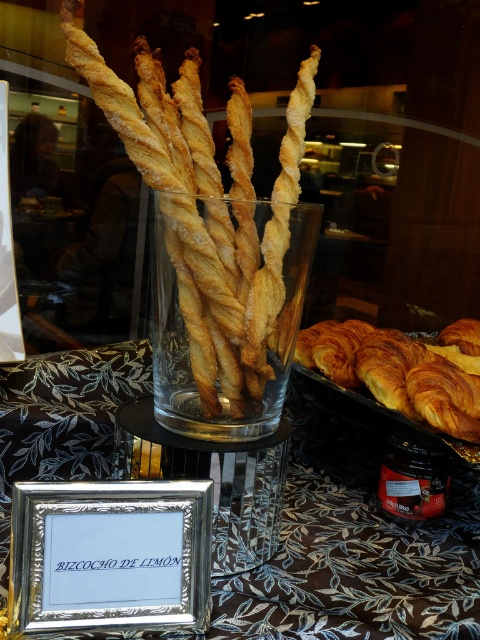
Question: Can you confirm if black fabric tablecloth at center is positioned to the left of golden-brown crispy pastry at center?

Choices:
 (A) no
 (B) yes

Answer: (B)

Question: Is black fabric tablecloth at center to the right of golden brown flaky croissant at lower right from the viewer's perspective?

Choices:
 (A) yes
 (B) no

Answer: (B)

Question: Which point is farther from the camera taking this photo?

Choices:
 (A) (113, 353)
 (B) (462, 372)

Answer: (A)

Question: Which point appears farthest from the camera in this image?

Choices:
 (A) (337, 353)
 (B) (166, 104)

Answer: (A)

Question: From the image, what is the correct spatial relationship of black fabric tablecloth at center in relation to silver metallic frame at lower center?

Choices:
 (A) above
 (B) below

Answer: (B)

Question: Which point is farther from the camera taking this photo?

Choices:
 (A) (187, 572)
 (B) (479, 396)
 (C) (99, 410)
 (D) (170, 237)

Answer: (C)